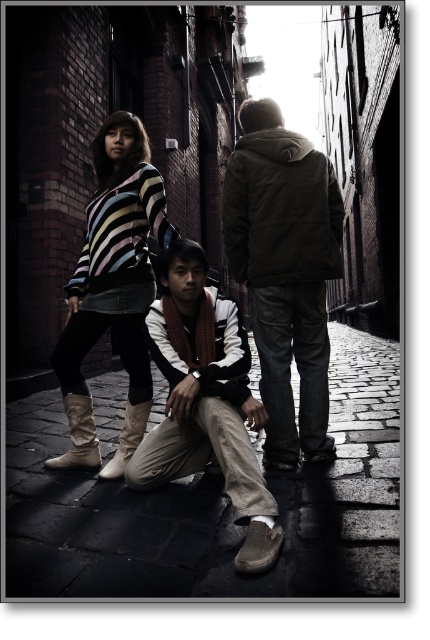
You are a photographer trying to capture both the dark brown leather jacket at center and the tan suede scarf at center in a single frame. Based on their sizes, which object would appear larger in the photo?

The dark brown leather jacket at center would appear larger in the photo because it is much taller than the tan suede scarf at center.

You are a fashion designer observing the two individuals in the alleyway. You need to determine which clothing item, the dark brown leather jacket at center or the striped sweater at center, would require more fabric to create a similar design. Based on their sizes in the image, which one would need more material?

The dark brown leather jacket at center has a greater height compared to the striped sweater at center, so it would require more fabric to create a similar design.

You are a photographer aiming to capture a candid shot of the two people in the alleyway. You notice the tan suede scarf at center and the striped sweater at center. Which object should you focus on first if you want to photograph the one that is more to the right?

The tan suede scarf at center is positioned on the right side of striped sweater at center, so you should focus on the tan suede scarf at center first to capture the one more to the right.